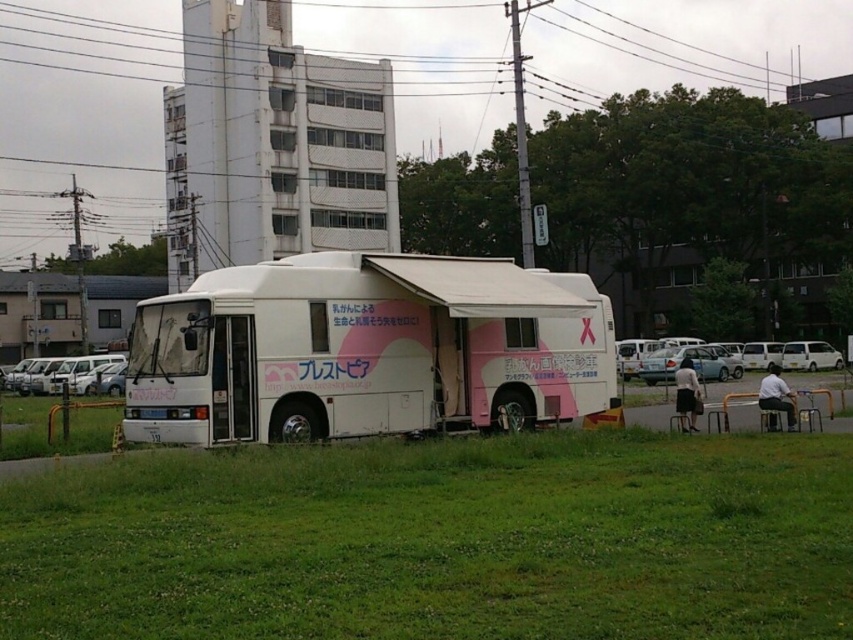
Question: Based on their relative distances, which object is nearer to the white matte van at center?

Choices:
 (A) green grass at lower center
 (B) white matte bus at center

Answer: (B)

Question: Does white matte van at center appear under white matte van at left?

Choices:
 (A) yes
 (B) no

Answer: (B)

Question: Which of the following is the closest to the observer?

Choices:
 (A) white matte van at center
 (B) green grass at lower center
 (C) white matte bus at center

Answer: (B)

Question: Can you confirm if green grass at lower center is positioned below white matte bus at center?

Choices:
 (A) no
 (B) yes

Answer: (B)

Question: Among these points, which one is farthest from the camera?

Choices:
 (A) (51, 385)
 (B) (671, 352)
 (C) (339, 545)

Answer: (A)

Question: Is white matte bus at center thinner than white matte van at left?

Choices:
 (A) yes
 (B) no

Answer: (A)